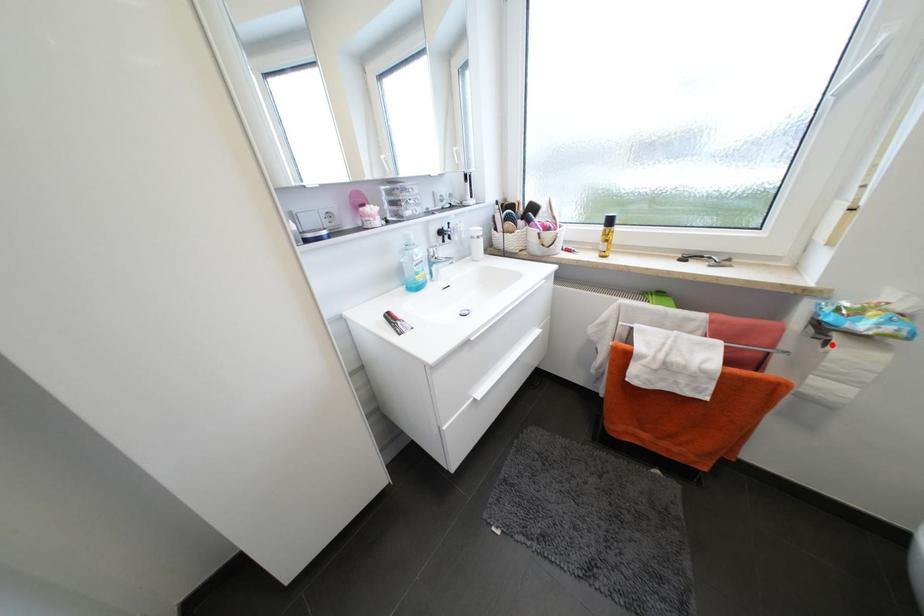
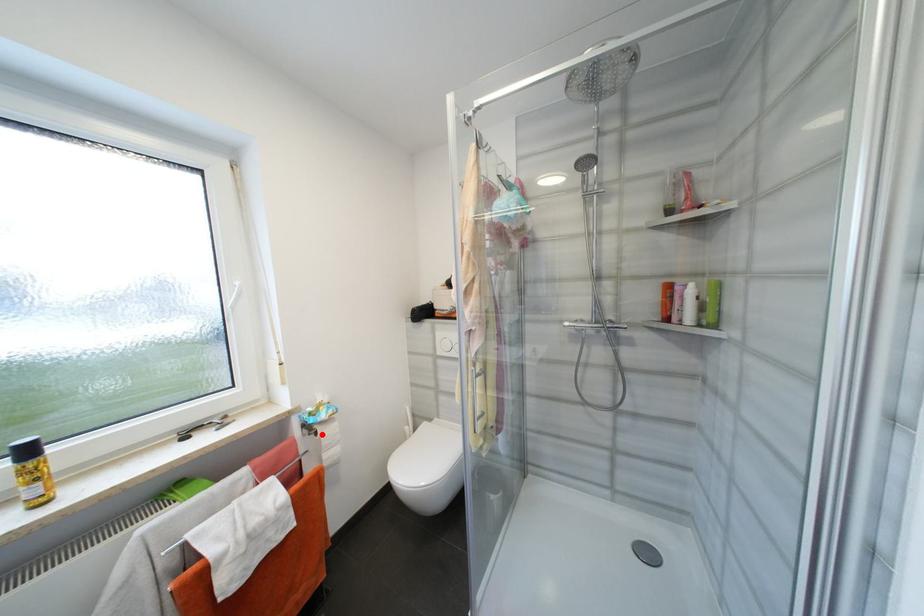
I am providing you with two images of the same scene from different viewpoints. A red point is marked on the first image and another point is marked on the second image. Do the highlighted points in image1 and image2 indicate the same real-world spot?

Yes